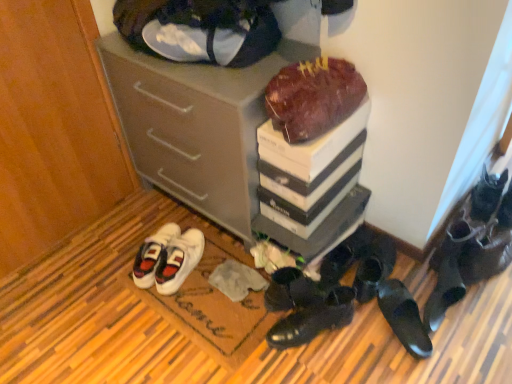
Question: Looking at their shapes, would you say black leather shoes at lower right, placed as the 8th footwear when sorted from left to right, is wider or thinner than black leather shoe at lower right, the first footwear from the right?

Choices:
 (A) wide
 (B) thin

Answer: (B)

Question: Considering the positions of black leather shoes at lower right, placed as the 8th footwear when sorted from left to right, and black leather shoe at lower right, the first footwear from the right, in the image, is black leather shoes at lower right, placed as the 8th footwear when sorted from left to right, bigger or smaller than black leather shoe at lower right, the first footwear from the right,?

Choices:
 (A) big
 (B) small

Answer: (A)

Question: Which object is the farthest from the leather handbag at upper center?

Choices:
 (A) white fabric doormat at lower center
 (B) black leather shoes at lower right, the fourth footwear viewed from the left
 (C) white suede sneakers at lower left, marked as the first footwear in a left-to-right arrangement
 (D) black leather shoes at lower right, the 2th footwear when ordered from right to left
 (E) black leather shoes at lower right, arranged as the seventh footwear when viewed from the left

Answer: (D)

Question: Estimate the real-world distances between objects in this image. Which object is closer to the black leather shoes at lower right, arranged as the seventh footwear when viewed from the left?

Choices:
 (A) chocolate matte cake at upper center
 (B) black leather shoes at lower right, positioned as the sixth footwear in left-to-right order
 (C) black leather shoes at lower center, placed as the 8th footwear when sorted from right to left
 (D) white suede sneakers at lower left, marked as the first footwear in a left-to-right arrangement
 (E) leather handbag at upper center

Answer: (B)